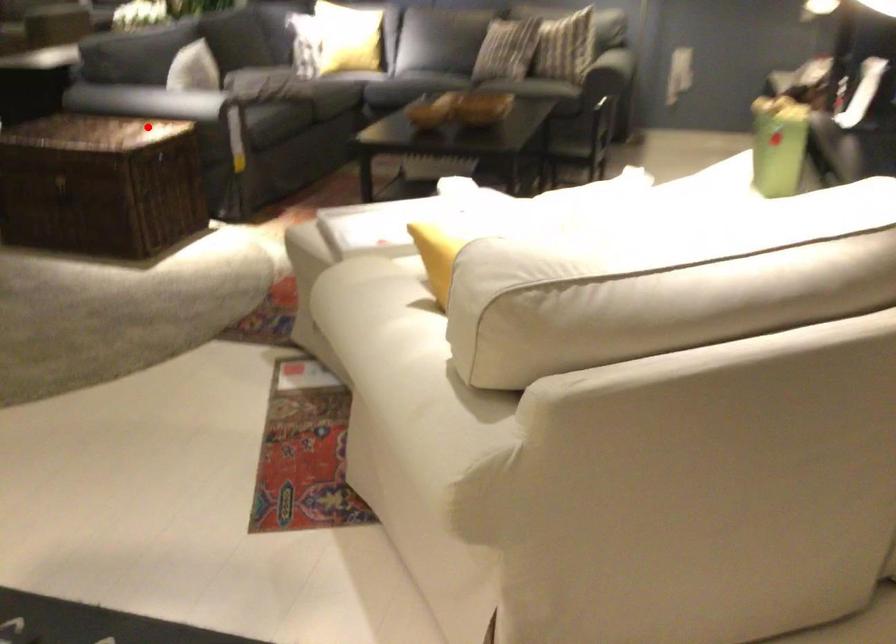
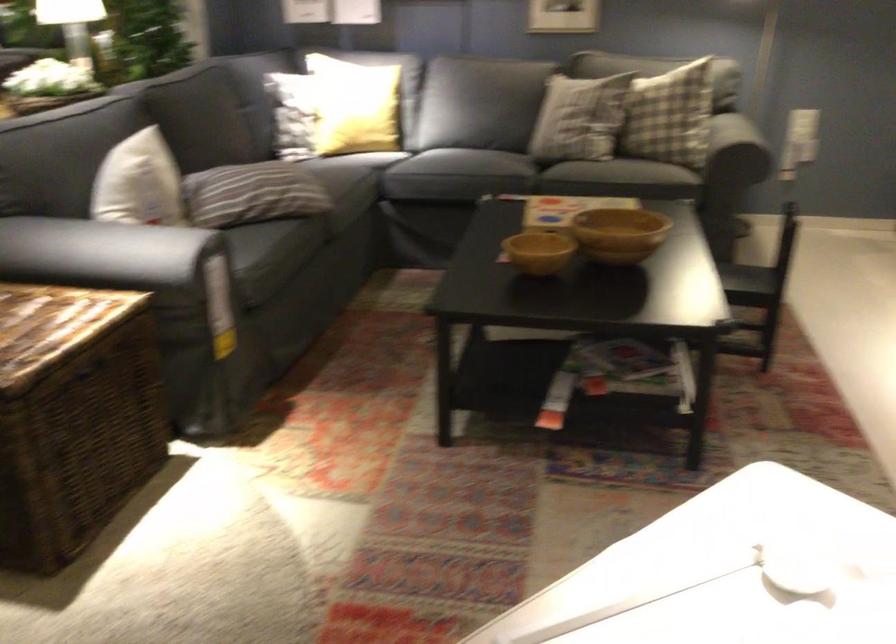
The point at the highlighted location is marked in the first image. Where is the corresponding point in the second image?

(55, 317)